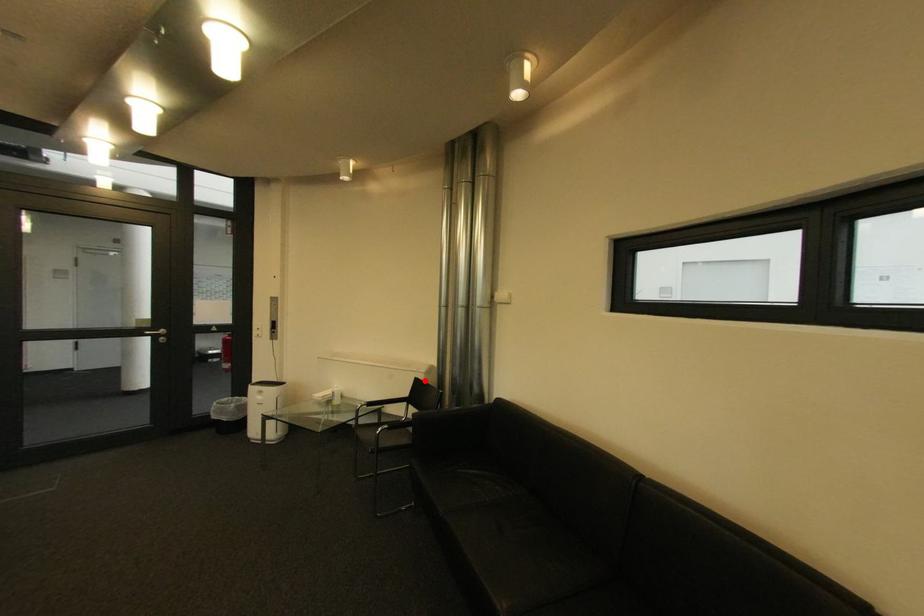
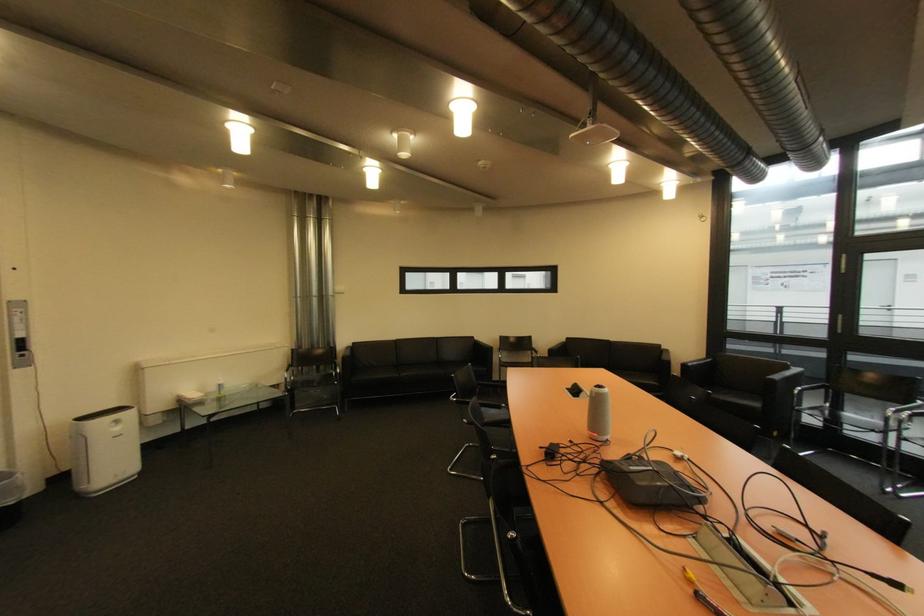
In the second image, find the point that corresponds to the highlighted location in the first image.

(301, 352)